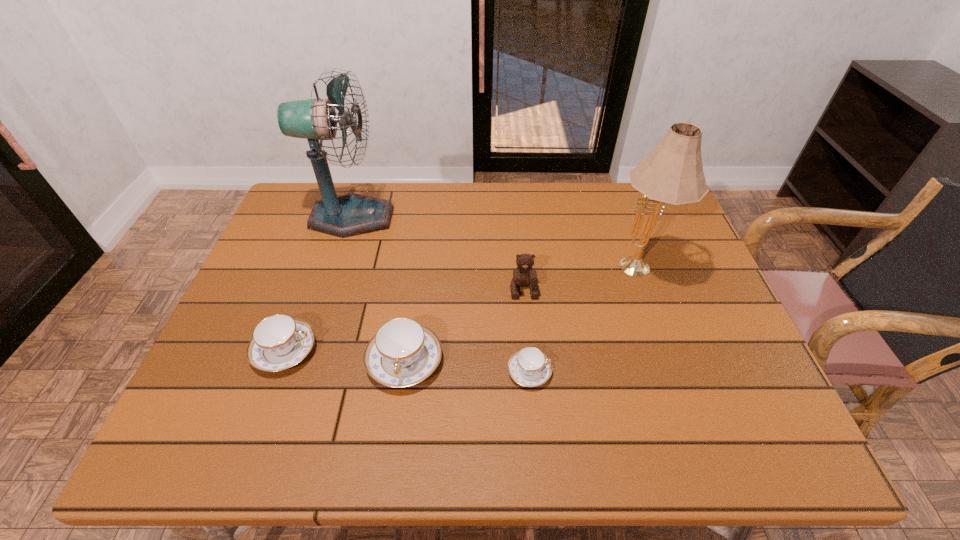
Please point a free position for a teacup on the right. Please provide its 2D coordinates. Your answer should be formatted as a tuple, i.e. [(x, y)], where the tuple contains the x and y coordinates of a point satisfying the conditions above.

[(659, 383)]